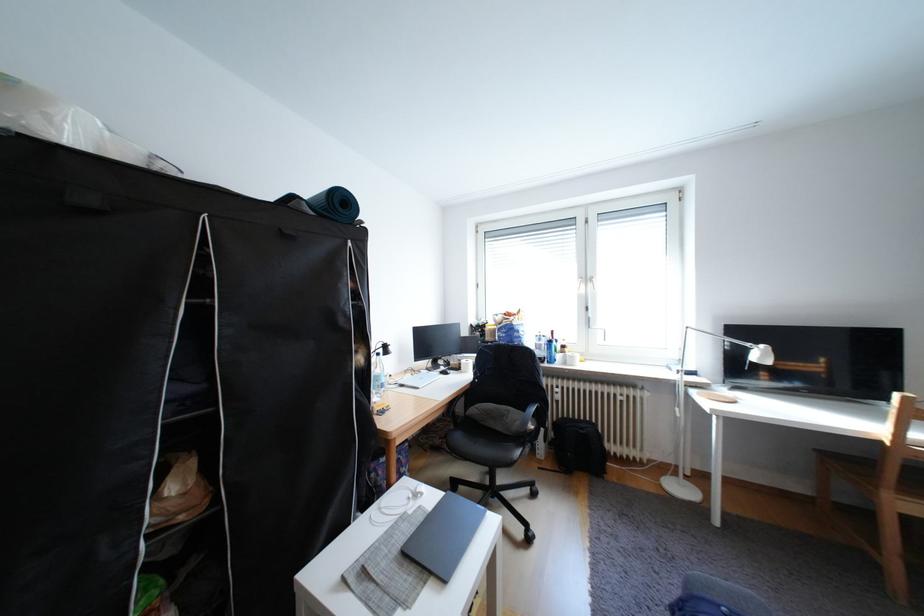
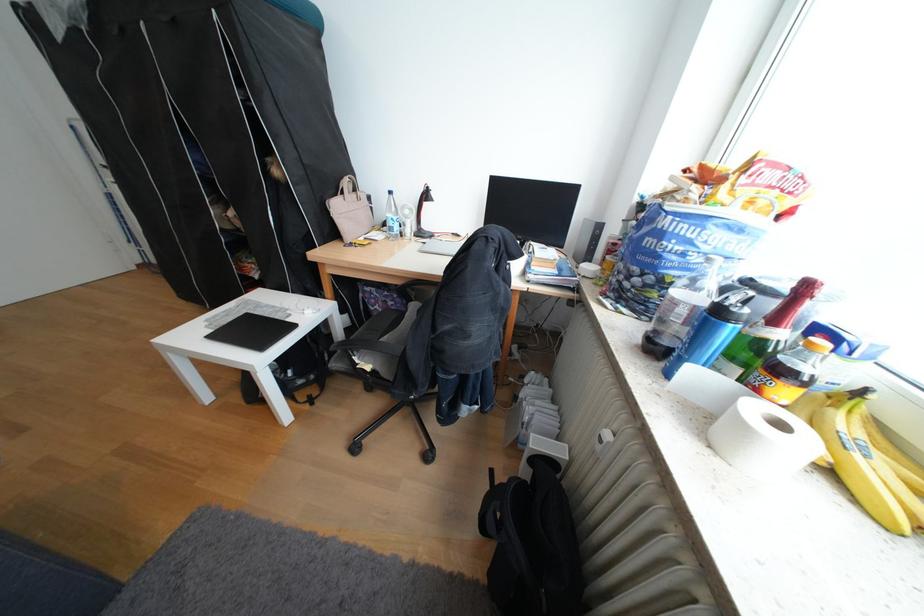
Find the pixel in the second image that matches (x=427, y=329) in the first image.

(504, 177)